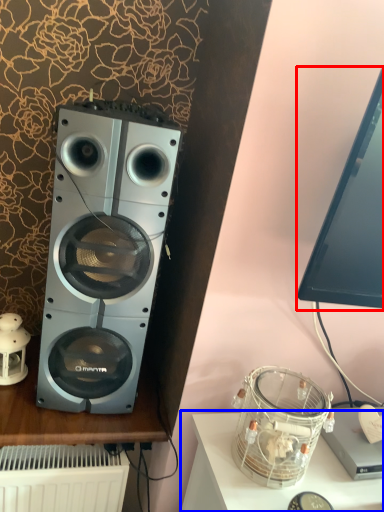
Question: Among these objects, which one is nearest to the camera, computer monitor (highlighted by a red box) or furniture (highlighted by a blue box)?

Choices:
 (A) computer monitor
 (B) furniture

Answer: (A)